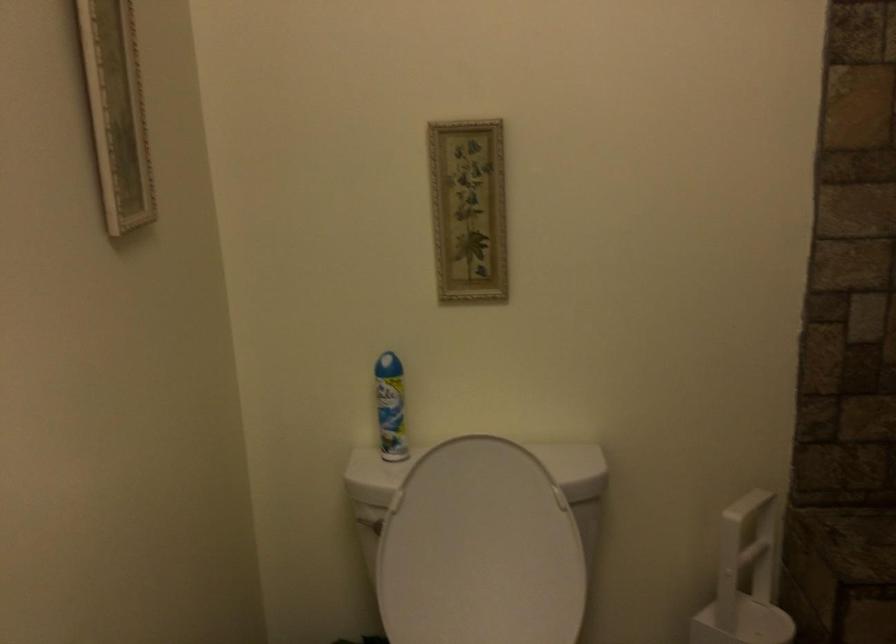
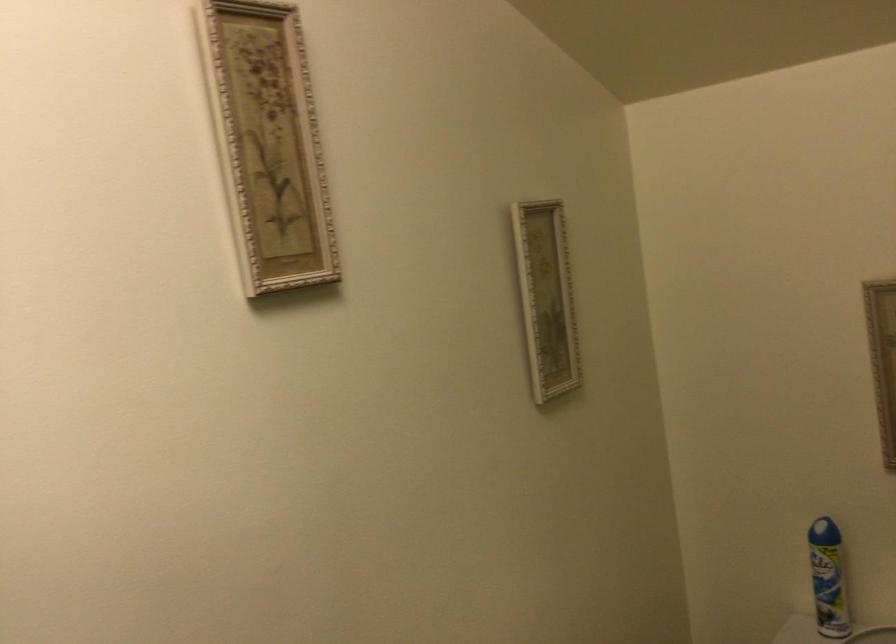
Question: The camera is either moving clockwise (left) or counter-clockwise (right) around the object. The first image is from the beginning of the video and the second image is from the end. Is the camera moving left or right when shooting the video?

Choices:
 (A) Left
 (B) Right

Answer: (B)